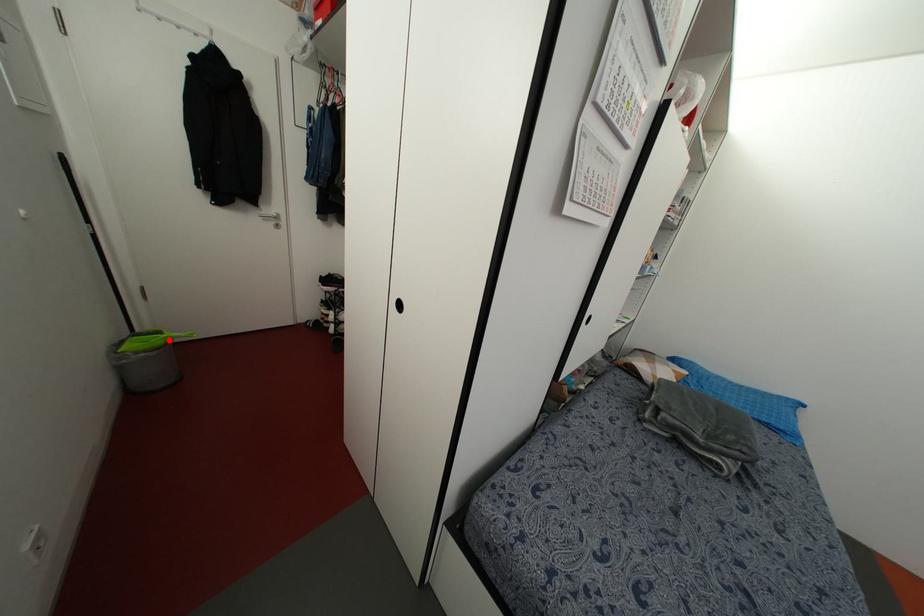
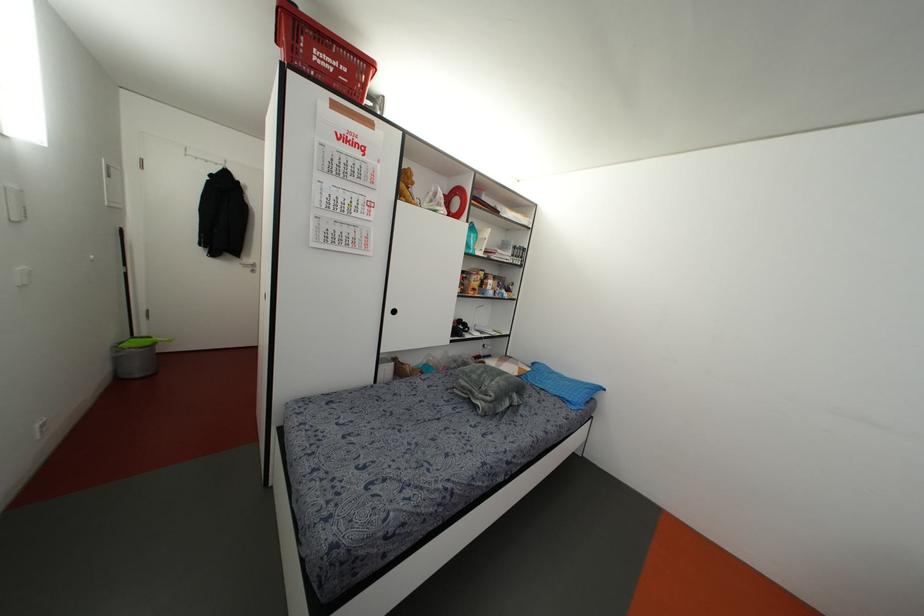
Question: I am providing you with two images of the same scene from different viewpoints. Image1 has a red point marked. In image2, the corresponding 3D location appears at what relative position? Reply with the corresponding letter.

Choices:
 (A) Closer
 (B) Farther

Answer: (B)